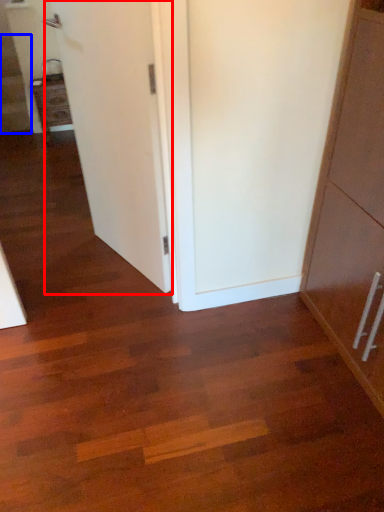
Question: Which of the following is the closest to the observer, door (highlighted by a red box) or stairwell (highlighted by a blue box)?

Choices:
 (A) door
 (B) stairwell

Answer: (A)